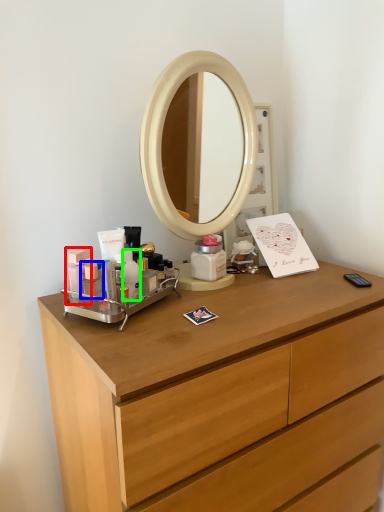
Question: Which object is positioned closest to toiletry (highlighted by a red box)? Select from toiletry (highlighted by a blue box) and toiletry (highlighted by a green box).

Choices:
 (A) toiletry
 (B) toiletry

Answer: (A)